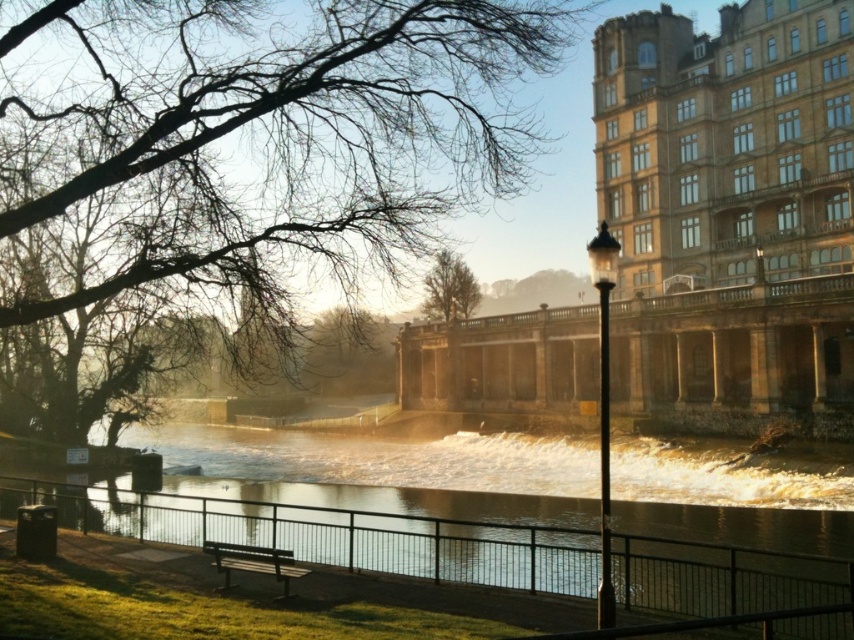
You are planning to take a photo of the shiny metallic water at center and the green leafy tree at center from the riverside. Which object would appear wider in the photo?

The shiny metallic water at center would appear wider in the photo because its width is larger than the green leafy tree at center.

You are standing at the riverside and see the shiny metallic water at center and the green leafy tree at center. Which object is positioned to the left of the other?

The shiny metallic water at center is to the left of the green leafy tree at center.

You are a bird looking for a place to perch. You see the bare branches at upper left and the green leafy tree at center. Which one is taller?

The bare branches at upper left is much taller than the green leafy tree at center.